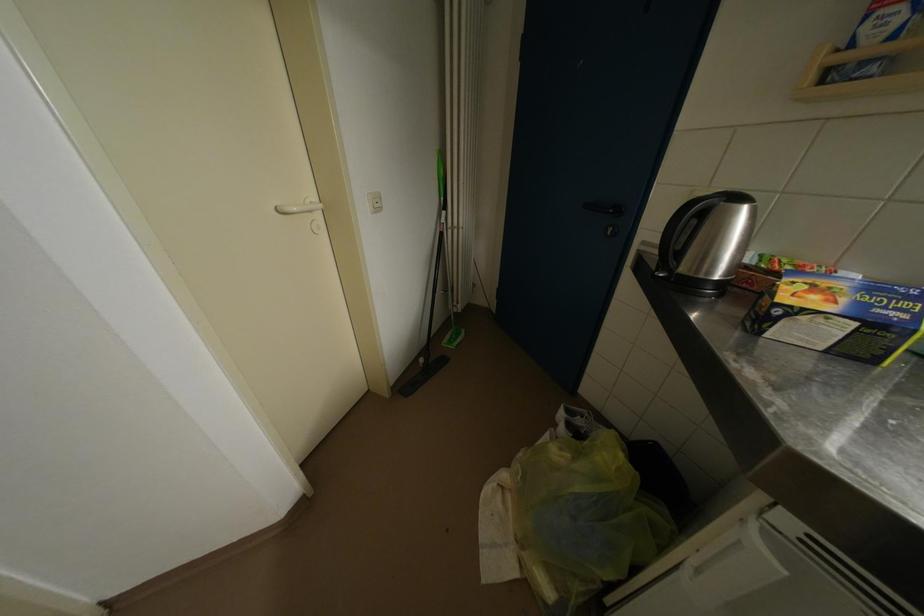
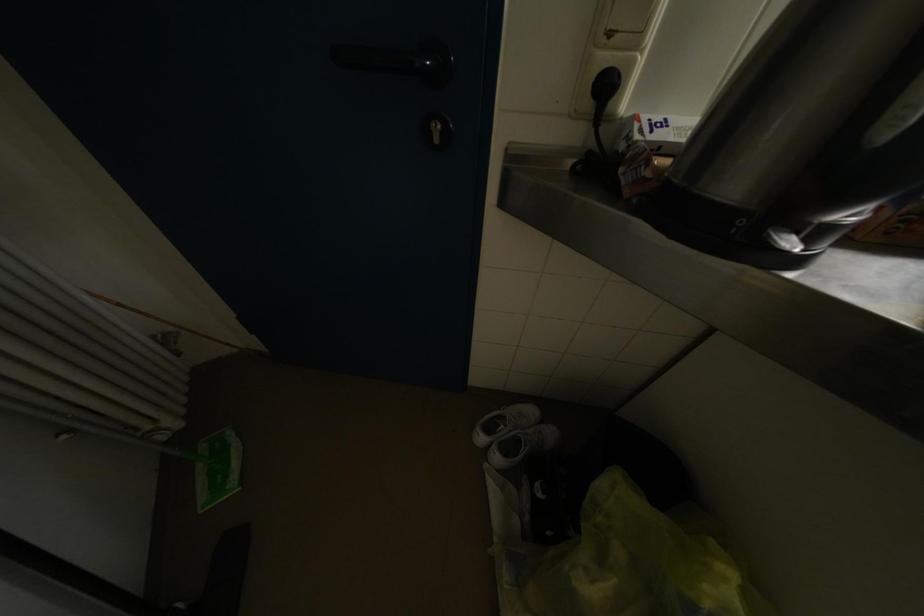
Based on the photo, first-person continuous shooting, in which direction is the camera rotating?

The camera rotated toward right-down.